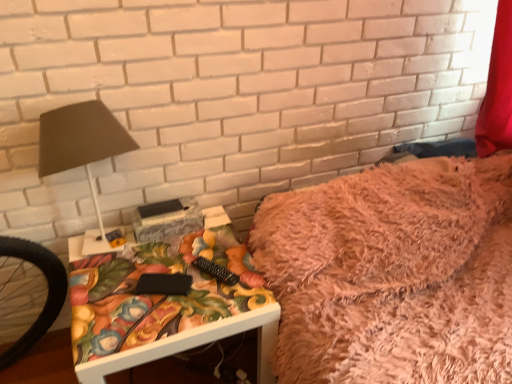
Question: Considering the relative positions of matte black lamp at left and white glossy table at lower left in the image provided, is matte black lamp at left behind white glossy table at lower left?

Choices:
 (A) yes
 (B) no

Answer: (B)

Question: From the image's perspective, is matte black lamp at left over white glossy table at lower left?

Choices:
 (A) yes
 (B) no

Answer: (A)

Question: Is matte black lamp at left outside white glossy table at lower left?

Choices:
 (A) no
 (B) yes

Answer: (B)

Question: Is matte black lamp at left bigger than white glossy table at lower left?

Choices:
 (A) yes
 (B) no

Answer: (B)

Question: Is matte black lamp at left beside white glossy table at lower left?

Choices:
 (A) no
 (B) yes

Answer: (A)

Question: Considering the relative sizes of matte black lamp at left and white glossy table at lower left in the image provided, is matte black lamp at left smaller than white glossy table at lower left?

Choices:
 (A) no
 (B) yes

Answer: (B)

Question: From the image's perspective, is white glossy table at lower left below matte black lamp at left?

Choices:
 (A) no
 (B) yes

Answer: (B)

Question: Considering the relative positions of white glossy table at lower left and matte black lamp at left in the image provided, is white glossy table at lower left to the left of matte black lamp at left from the viewer's perspective?

Choices:
 (A) yes
 (B) no

Answer: (B)

Question: Is white glossy table at lower left to the right of matte black lamp at left from the viewer's perspective?

Choices:
 (A) yes
 (B) no

Answer: (A)

Question: From a real-world perspective, does white glossy table at lower left stand above matte black lamp at left?

Choices:
 (A) no
 (B) yes

Answer: (A)

Question: Is there a large distance between white glossy table at lower left and matte black lamp at left?

Choices:
 (A) yes
 (B) no

Answer: (B)

Question: Is white glossy table at lower left facing away from matte black lamp at left?

Choices:
 (A) no
 (B) yes

Answer: (A)

Question: From the image's perspective, does fuzzy pink blanket at upper right appear higher than white glossy table at lower left?

Choices:
 (A) yes
 (B) no

Answer: (A)